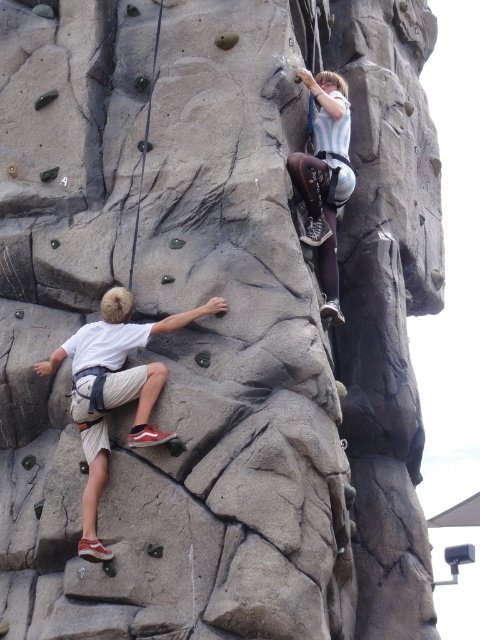
Who is higher up, white cotton shirt at left or striped fabric shirt at upper right?

striped fabric shirt at upper right is above.

Which is in front, point (101, 298) or point (307, 243)?

Point (101, 298)

What are the coordinates of `white cotton shirt at left` in the screenshot? It's located at (113, 390).